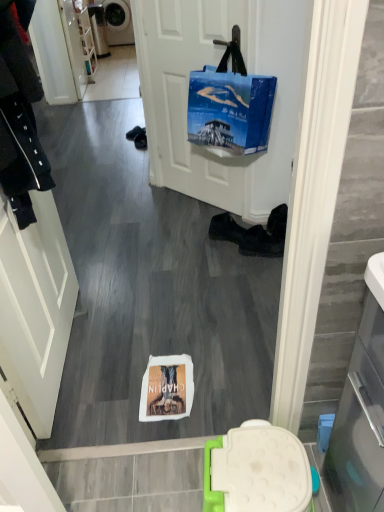
Identify the location of spots to the right of white glossy door at left. The height and width of the screenshot is (512, 384). click(147, 338).